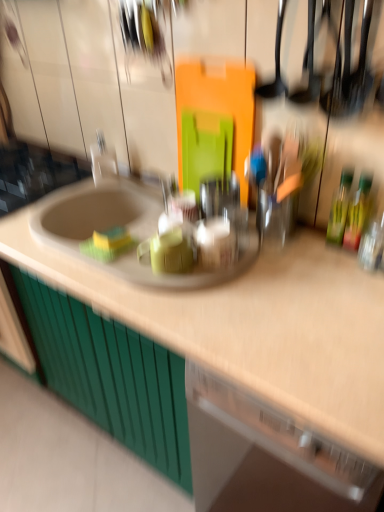
Locate an element on the screen. The width and height of the screenshot is (384, 512). vacant space to the left of green glass bottle at right, marked as the second bottle in a left-to-right arrangement is located at coordinates (x=301, y=258).